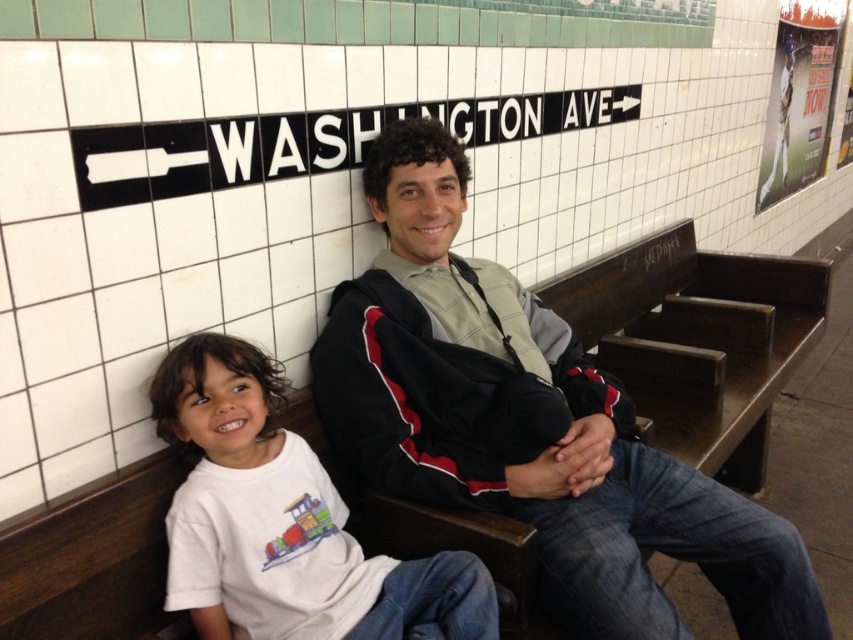
You are a person trying to sit between the dark gray jacket at center and the white cotton shirt at lower left on the wooden bench. Is there enough space for you to sit comfortably?

The dark gray jacket at center might be wider than the white cotton shirt at lower left, so there may not be enough space for you to sit comfortably between them.

You are standing in the subway station and want to reach a specific point marked at coordinates point [462,330]. If your height is 5 feet 6 inches, will you be able to comfortably reach that point without stretching?

The distance of point [462,330] from viewer is 5.32 feet. Since your height is 5 feet 6 inches, which is 5.5 feet, you can comfortably reach the point without stretching.

You are a clothing designer observing the subway scene. You need to determine which item of clothing requires more fabric to produce between the dark gray jacket at center and the white cotton shirt at lower left. Which one would need more fabric?

The dark gray jacket at center is larger in size than the white cotton shirt at lower left, so it would require more fabric to produce.